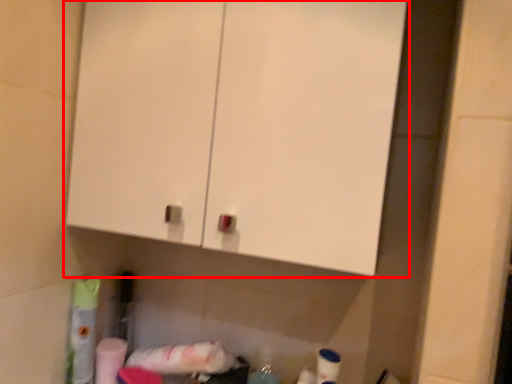
Question: From the image's perspective, what is the correct spatial relationship of cabinetry (annotated by the red box) in relation to toilet paper?

Choices:
 (A) above
 (B) below

Answer: (A)